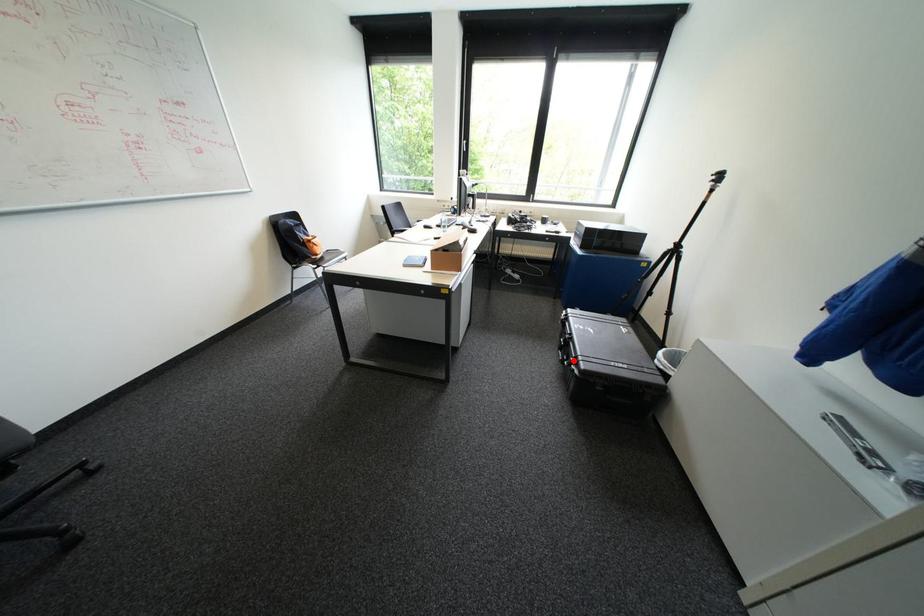
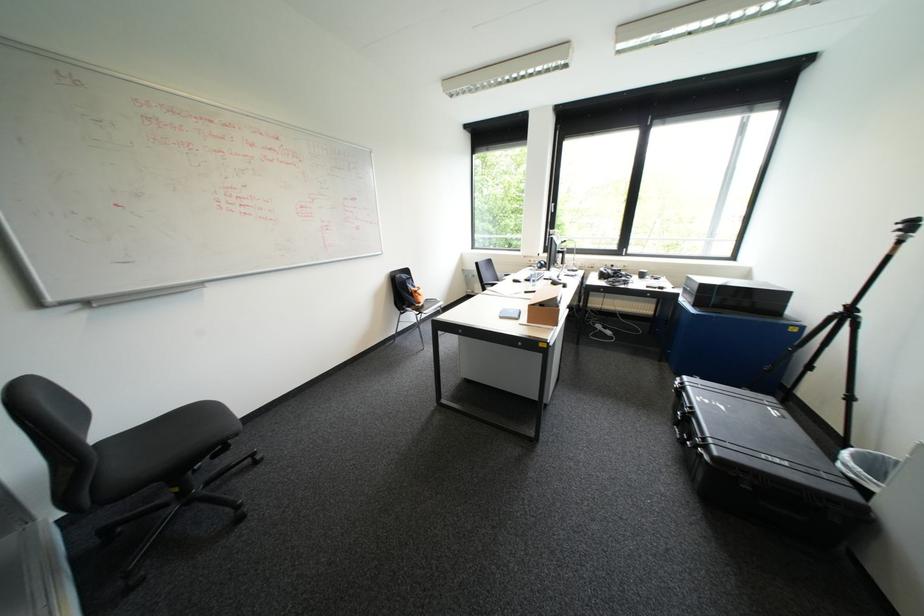
The point at the highlighted location is marked in the first image. Where is the corresponding point in the second image?

(697, 440)